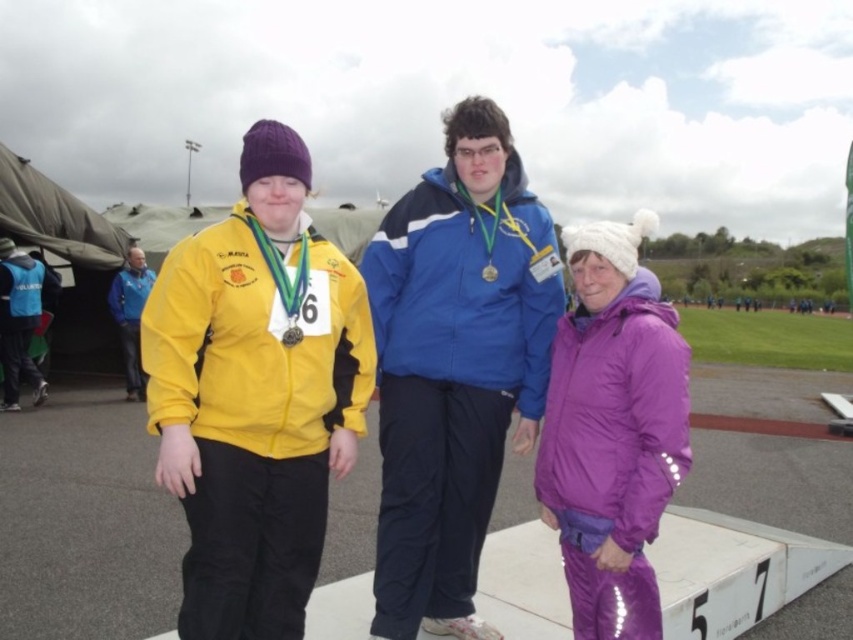
Based on the scene description, can you determine the spatial relationship between the blue reflective vest at left and the metallic gold medal at center?

The blue reflective vest at left is positioned to the left of the metallic gold medal at center.